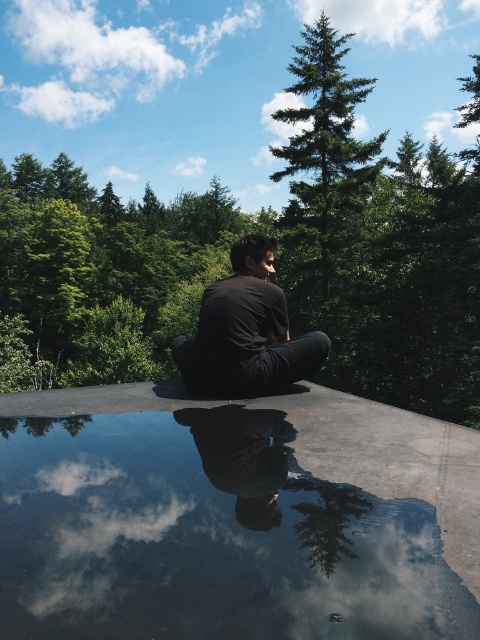
Question: Estimate the real-world distances between objects in this image. Which object is farther from the glossy reflective water at center?

Choices:
 (A) black matte shirt at center
 (B) green leafy tree at upper center

Answer: (B)

Question: Does black matte shirt at center appear over black glossy pants at center?

Choices:
 (A) yes
 (B) no

Answer: (A)

Question: Among these objects, which one is nearest to the camera?

Choices:
 (A) glossy reflective water at center
 (B) black matte shirt at center
 (C) green leafy tree at upper center
 (D) black glossy pants at center

Answer: (A)

Question: Does black matte shirt at center have a smaller size compared to black glossy pants at center?

Choices:
 (A) no
 (B) yes

Answer: (A)

Question: Is glossy reflective water at center to the right of black glossy pants at center from the viewer's perspective?

Choices:
 (A) no
 (B) yes

Answer: (B)

Question: Which object is closer to the camera taking this photo?

Choices:
 (A) black glossy pants at center
 (B) black matte shirt at center
 (C) green leafy tree at upper center
 (D) glossy reflective water at center

Answer: (D)